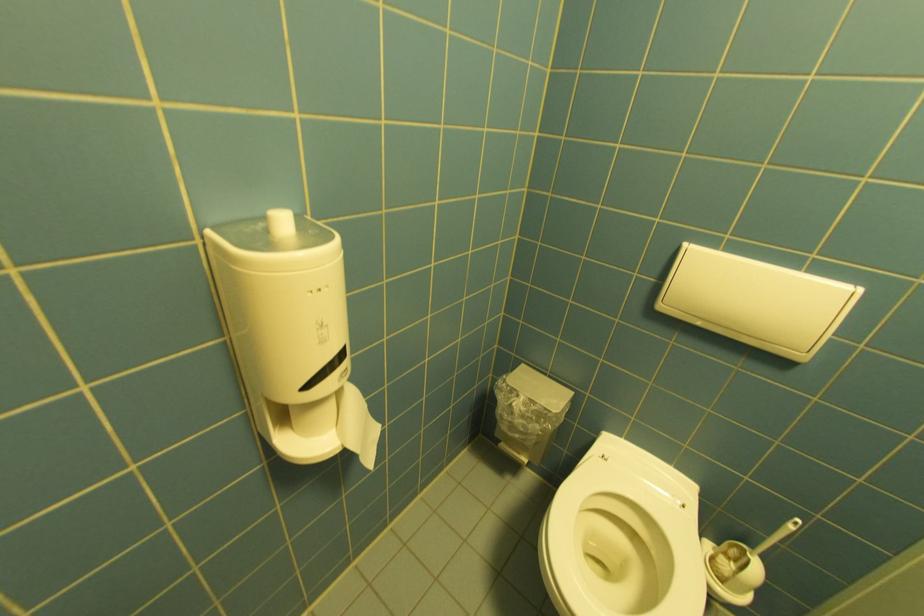
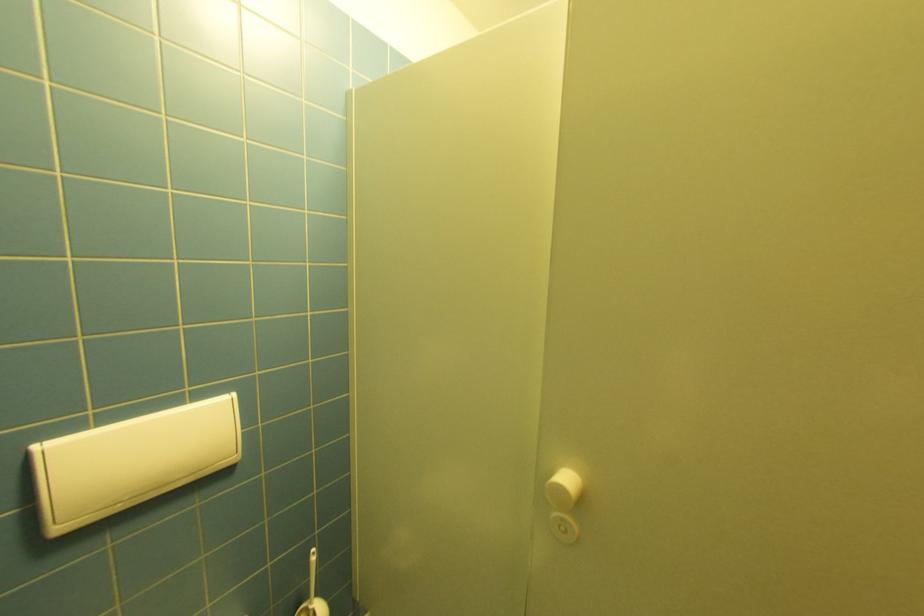
Find the pixel in the second image that matches point (751, 552) in the first image.

(312, 610)